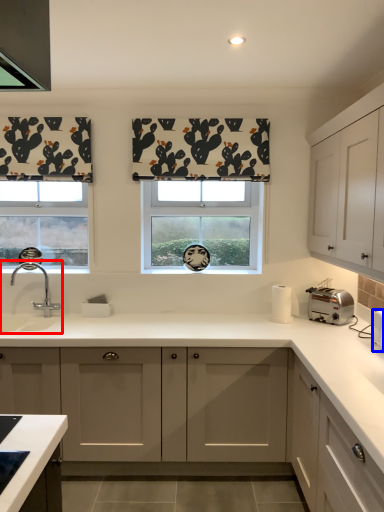
Question: Which point is closer to the camera, sink (highlighted by a red box) or appliance (highlighted by a blue box)?

Choices:
 (A) sink
 (B) appliance

Answer: (B)